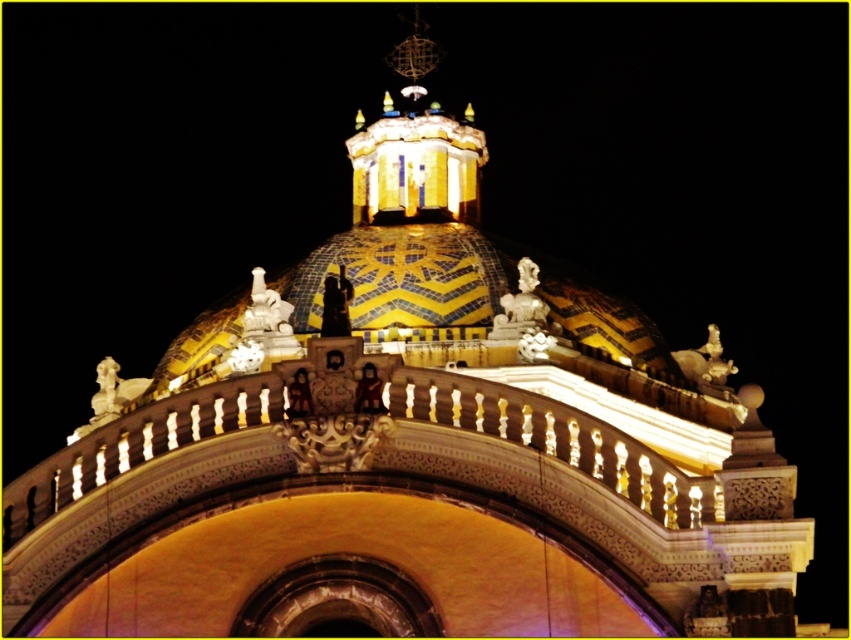
In the scene shown: You are an architect reviewing the dome design and notice the white marble statue at upper center and the gold metallic statue at upper right. Which statue is positioned to the left when viewed from the front of the dome?

The white marble statue at upper center is positioned to the left of the gold metallic statue at upper right when viewed from the front of the dome.

You are an architect examining the dome structure. You notice the gold metallic statue at upper right and the polished bronze statue at center. Based on their positions, which one is positioned higher up on the dome?

The polished bronze statue at center is positioned higher up on the dome because the gold metallic statue at upper right is located below it.

Consider the image. You are standing in front of the illuminated dome and want to locate two points marked on the dome. The first point is at coordinates point (711, 372) and the second is at point (320, 332). Which point is closer to you?

Point (320, 332) is closer to you since it is in front of point (711, 372).